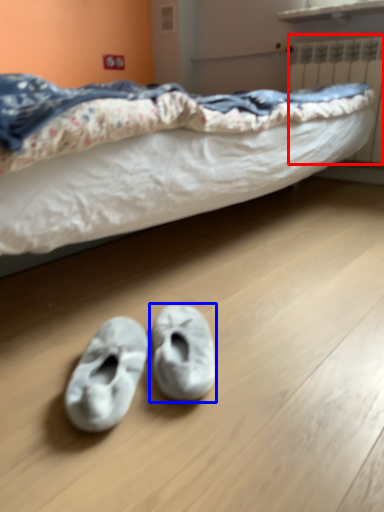
Question: Which point is closer to the camera, radiator (highlighted by a red box) or footwear (highlighted by a blue box)?

Choices:
 (A) radiator
 (B) footwear

Answer: (B)